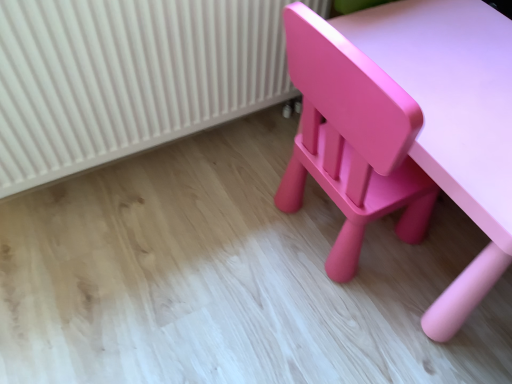
Question: Should I look upward or downward to see matte pink table at lower right?

Choices:
 (A) down
 (B) up

Answer: (B)

Question: Can you confirm if white ribbed radiator at upper left is taller than matte pink table at lower right?

Choices:
 (A) no
 (B) yes

Answer: (B)

Question: Is white ribbed radiator at upper left oriented towards matte pink table at lower right?

Choices:
 (A) no
 (B) yes

Answer: (B)

Question: Is white ribbed radiator at upper left thinner than matte pink table at lower right?

Choices:
 (A) yes
 (B) no

Answer: (A)

Question: Is white ribbed radiator at upper left in front of matte pink table at lower right?

Choices:
 (A) no
 (B) yes

Answer: (A)

Question: Is the position of white ribbed radiator at upper left more distant than that of matte pink table at lower right?

Choices:
 (A) no
 (B) yes

Answer: (B)

Question: Considering the relative sizes of white ribbed radiator at upper left and matte pink table at lower right in the image provided, is white ribbed radiator at upper left shorter than matte pink table at lower right?

Choices:
 (A) yes
 (B) no

Answer: (B)

Question: From a real-world perspective, is matte pink table at lower right beneath white ribbed radiator at upper left?

Choices:
 (A) no
 (B) yes

Answer: (B)

Question: From the image's perspective, is matte pink table at lower right below white ribbed radiator at upper left?

Choices:
 (A) no
 (B) yes

Answer: (B)

Question: Is matte pink table at lower right positioned beyond the bounds of white ribbed radiator at upper left?

Choices:
 (A) yes
 (B) no

Answer: (A)

Question: Is matte pink table at lower right at the right side of white ribbed radiator at upper left?

Choices:
 (A) yes
 (B) no

Answer: (A)

Question: Is matte pink table at lower right thinner than white ribbed radiator at upper left?

Choices:
 (A) no
 (B) yes

Answer: (A)

Question: Does matte pink table at lower right appear on the left side of white ribbed radiator at upper left?

Choices:
 (A) yes
 (B) no

Answer: (B)

Question: In the image, is matte pink table at lower right on the left side or the right side of white ribbed radiator at upper left?

Choices:
 (A) left
 (B) right

Answer: (B)